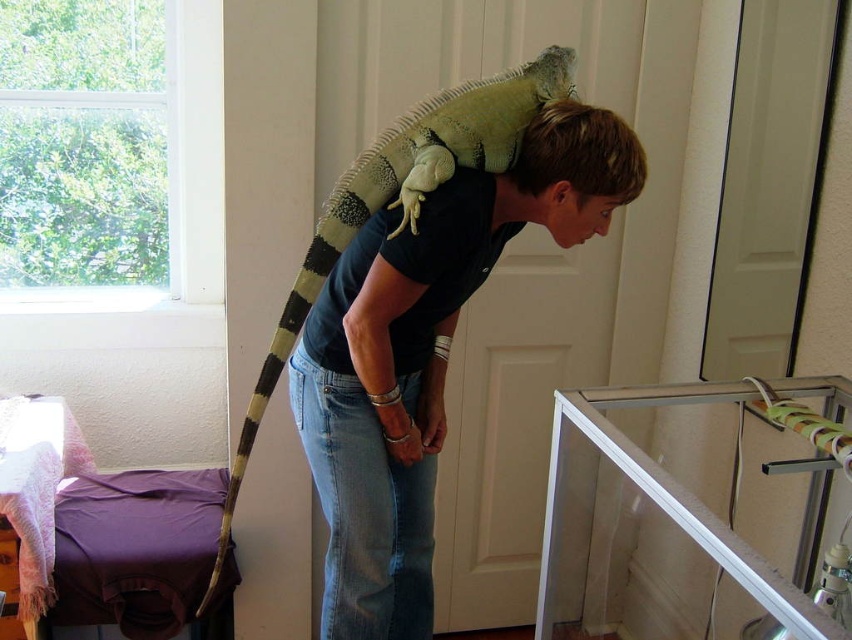
Is matte black shirt at upper center to the right of short blonde hair at upper center from the viewer's perspective?

Incorrect, matte black shirt at upper center is not on the right side of short blonde hair at upper center.

Based on the photo, who is taller, matte black shirt at upper center or short blonde hair at upper center?

With more height is matte black shirt at upper center.

Which is behind, point (390, 538) or point (626, 193)?

The point (390, 538) is behind.

Identify the location of matte black shirt at upper center. (426, 353).